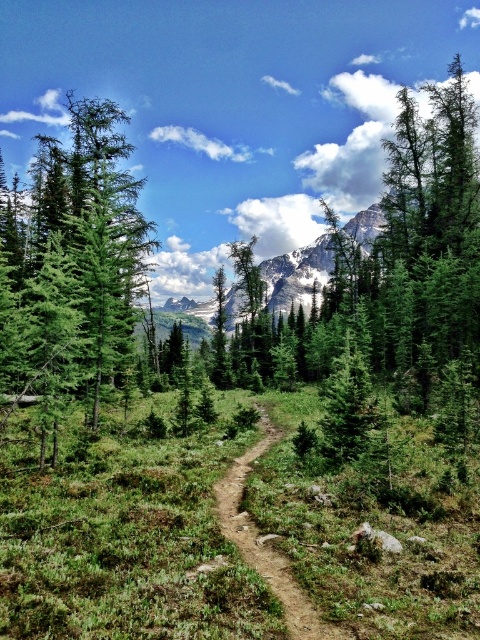
Is green matte tree at left above brown dirt track at center?

Correct, green matte tree at left is located above brown dirt track at center.

Is point (24, 376) positioned after point (271, 552)?

Yes, it is.

Locate an element on the screen. This screenshot has width=480, height=640. green matte tree at left is located at coordinates (72, 272).